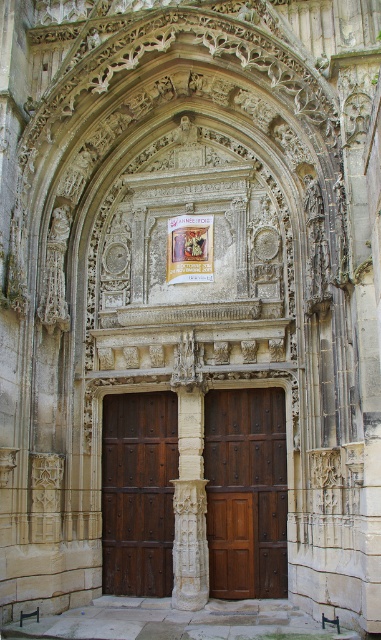
Which is more to the left, dark brown wood door at center or white stone column at center?

Positioned to the left is dark brown wood door at center.

In order to click on dark brown wood door at center in this screenshot , I will do `click(137, 492)`.

At what (x,y) coordinates should I click in order to perform the action: click on dark brown wood door at center. Please return your answer as a coordinate pair (x, y). The image size is (381, 640). Looking at the image, I should click on (137, 492).

Based on the photo, does polished wood door at center have a greater height compared to dark brown wood door at center?

In fact, polished wood door at center may be shorter than dark brown wood door at center.

Which is behind, point (259, 470) or point (110, 476)?

The point (110, 476) is behind.

Between point (262, 561) and point (144, 570), which one is positioned in front?

Point (262, 561) is in front.

Locate an element on the screen. polished wood door at center is located at coordinates (246, 492).

Who is more forward, (212, 392) or (188, 548)?

Point (188, 548) is in front.

Which is more to the left, polished wood door at center or white stone column at center?

white stone column at center is more to the left.

Is point (238, 397) positioned before point (198, 444)?

No.

Identify the location of polished wood door at center. This screenshot has height=640, width=381. (246, 492).